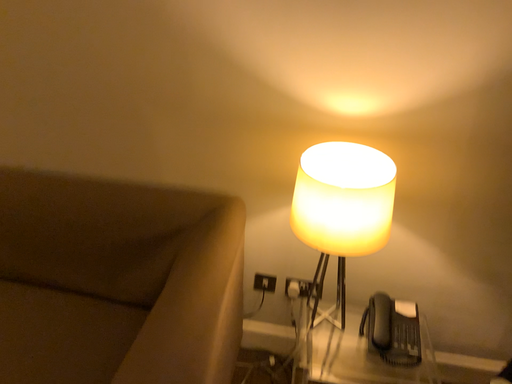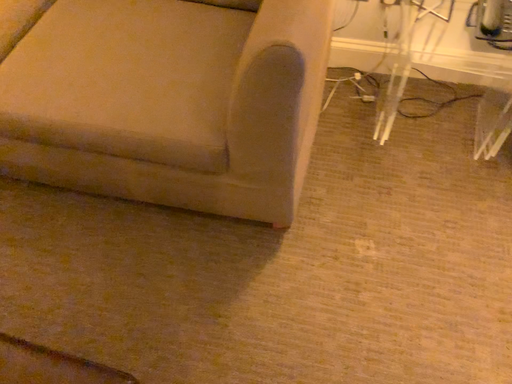
Question: Which way did the camera rotate in the video?

Choices:
 (A) rotated upward
 (B) rotated downward

Answer: (B)